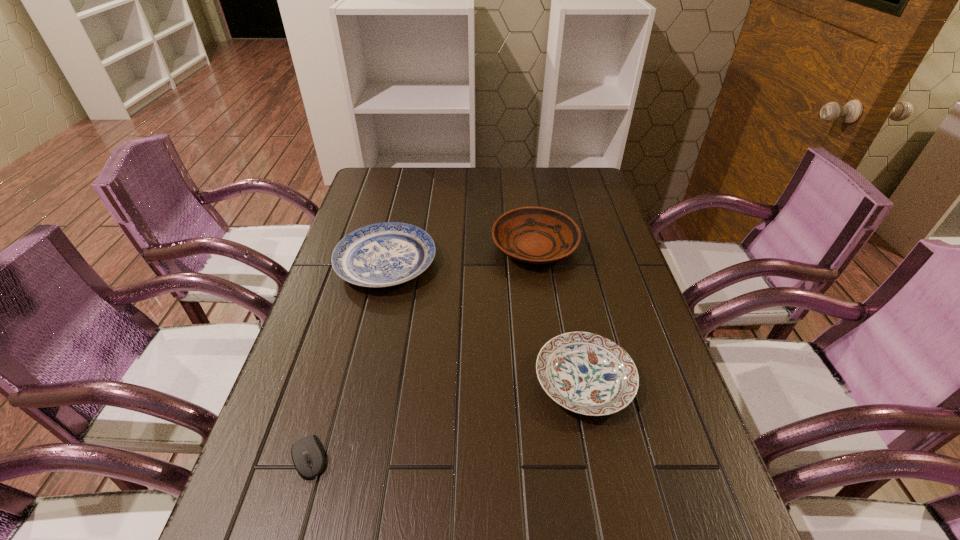
Where is `the tallest object`? The height and width of the screenshot is (540, 960). the tallest object is located at coordinates (535, 235).

At what (x,y) coordinates should I click in order to perform the action: click on the leftmost plate. Please return your answer as a coordinate pair (x, y). Looking at the image, I should click on (385, 254).

Where is `the second nearest object`? The width and height of the screenshot is (960, 540). the second nearest object is located at coordinates (586, 373).

The height and width of the screenshot is (540, 960). I want to click on the shortest object, so click(308, 455).

This screenshot has width=960, height=540. I want to click on computer equipment, so click(308, 455).

Locate an element on the screen. The height and width of the screenshot is (540, 960). blank space located on the front of the tallest object is located at coordinates (542, 301).

Locate an element on the screen. vacant space located 0.120m on the back of the leftmost plate is located at coordinates (398, 212).

What are the coordinates of `free space located 0.060m on the right of the nearest plate` in the screenshot? It's located at (660, 381).

At what (x,y) coordinates should I click in order to perform the action: click on vacant space located 0.250m on the right of the shortest object. Please return your answer as a coordinate pair (x, y). The width and height of the screenshot is (960, 540). Looking at the image, I should click on (458, 457).

Image resolution: width=960 pixels, height=540 pixels. I want to click on plate present at the left edge, so click(x=385, y=254).